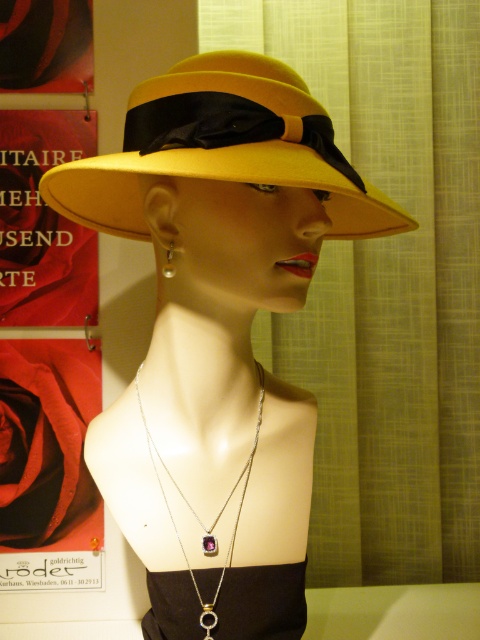
Does point (180, 86) lie in front of point (152, 438)?

That is True.

Between point (152, 115) and point (214, 637), which one is positioned in front?

Point (152, 115) is more forward.

Image resolution: width=480 pixels, height=640 pixels. Identify the location of yellow felt hat at center. (222, 147).

Does point (183, 208) come in front of point (164, 268)?

Yes, point (183, 208) is in front of point (164, 268).

Based on the photo, does matte yellow hat at center lie behind silver metallic earring at upper left?

No, matte yellow hat at center is closer to the viewer.

Where is `matte yellow hat at center`? The height and width of the screenshot is (640, 480). matte yellow hat at center is located at coordinates (218, 333).

Is black satin dress at center to the left of silver/golden chain necklace with gemstone pendant at center from the viewer's perspective?

In fact, black satin dress at center is to the right of silver/golden chain necklace with gemstone pendant at center.

Can you confirm if black satin dress at center is taller than silver/golden chain necklace with gemstone pendant at center?

In fact, black satin dress at center may be shorter than silver/golden chain necklace with gemstone pendant at center.

Between point (241, 618) and point (233, 531), which one is positioned behind?

Positioned behind is point (233, 531).

Locate an element on the screen. black satin dress at center is located at coordinates (262, 602).